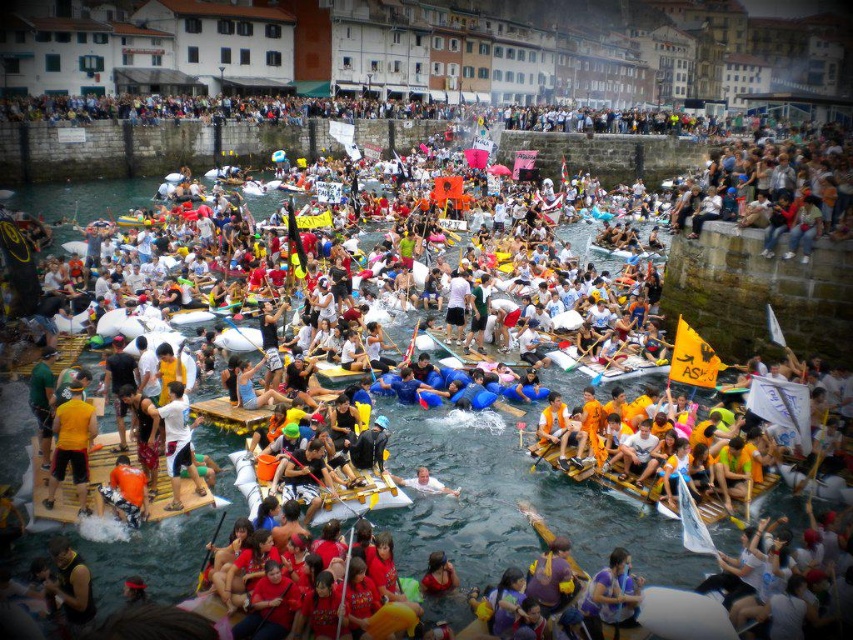
You are a photographer standing on the riverbank and want to capture both the white matte shirt at center and the orange life vest at center in a single photo. Which object should you focus on first to ensure both are in frame?

You should focus on the orange life vest at center first since it is larger than the white matte shirt at center, ensuring it fits within the frame while also capturing the smaller white matte shirt at center.

You are standing at the point with coordinates point (170, 448) and want to reach the point with coordinates point (592, 381). Which direction should you move to get closer to your destination?

You should move backward since point (170, 448) is in front of point (592, 381), meaning the destination is behind your current position.

You are a participant in this water festival and need to choose between the orange life vest at center and the wooden paddle at center to place on your makeshift raft. Which item is taller and should be placed where to avoid blocking the view?

The orange life vest at center is taller than the wooden paddle at center. To avoid blocking the view, place the orange life vest at center in a lower position or the wooden paddle at center in a higher position.